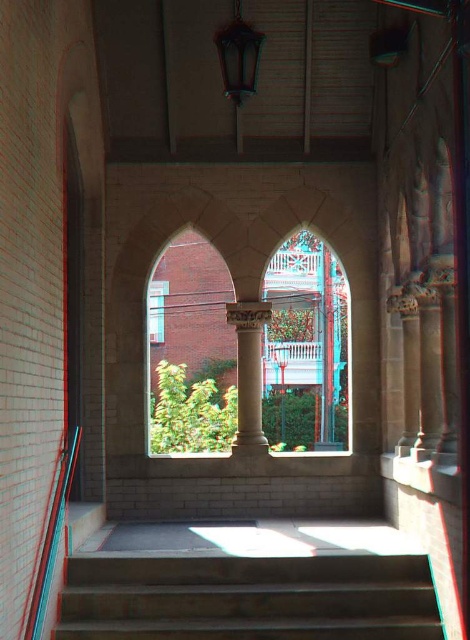
Consider the image. You are standing in the arched passageway and want to walk towards the white marble column at center and the wooden lantern at upper center. Which object will you approach first as you move forward through the passageway?

The wooden lantern at upper center will be approached first because the white marble column at center is positioned to its right, meaning it is further along the path compared to the lantern which is centrally ahead.

You are standing at the entrance of the arched passageway and want to take a photo of the white marble column at center. According to the coordinates provided, where should you aim your camera to capture it?

You should aim your camera at point 0.584 on the horizontal axis and 0.530 on the vertical axis to capture the white marble column at center.